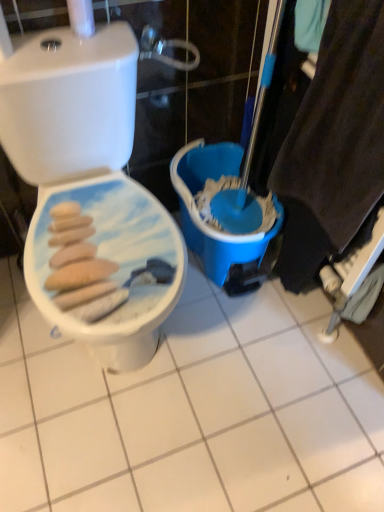
Identify the location of vacant region in front of white glossy toilet seat at left. (116, 441).